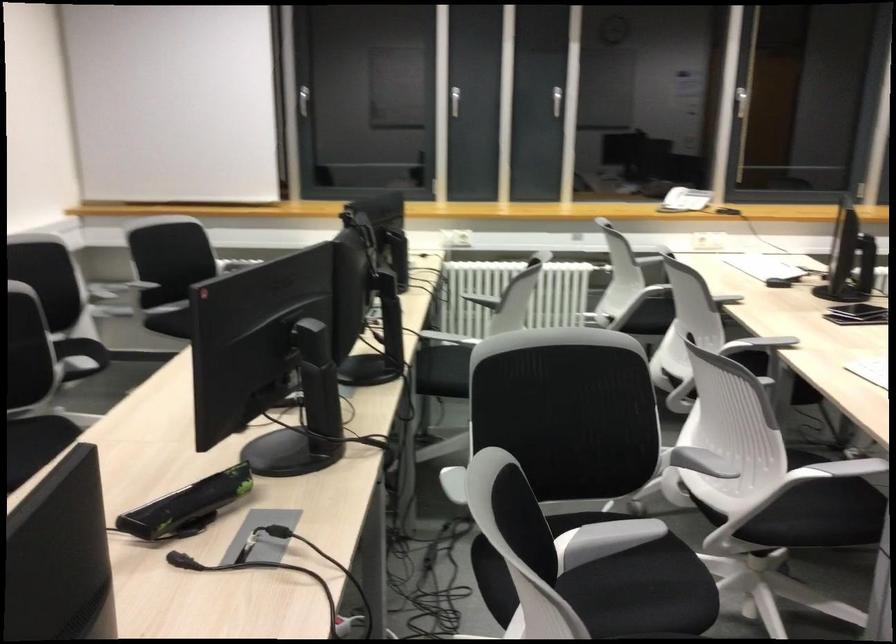
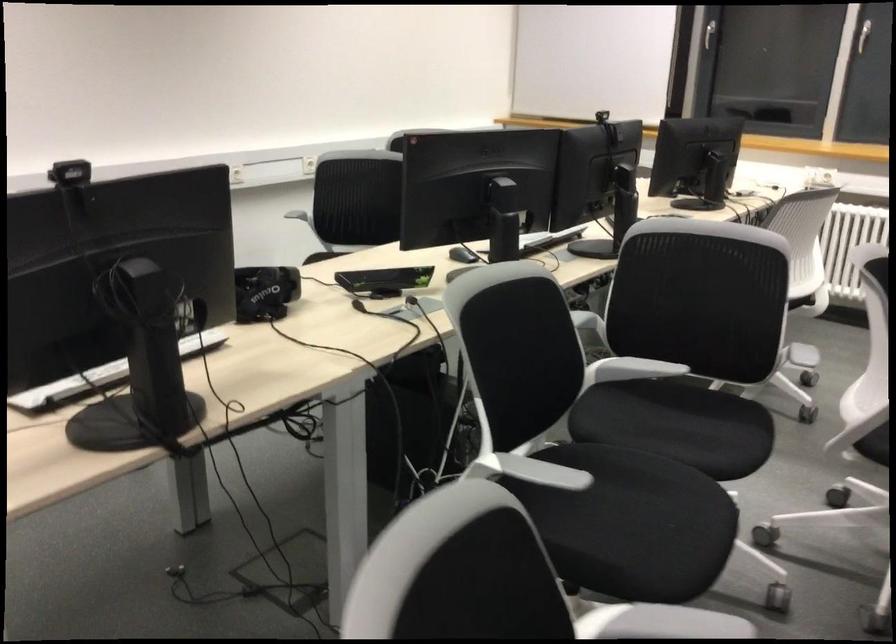
In the second image, find the point that corresponds to (754,527) in the first image.

(874, 444)